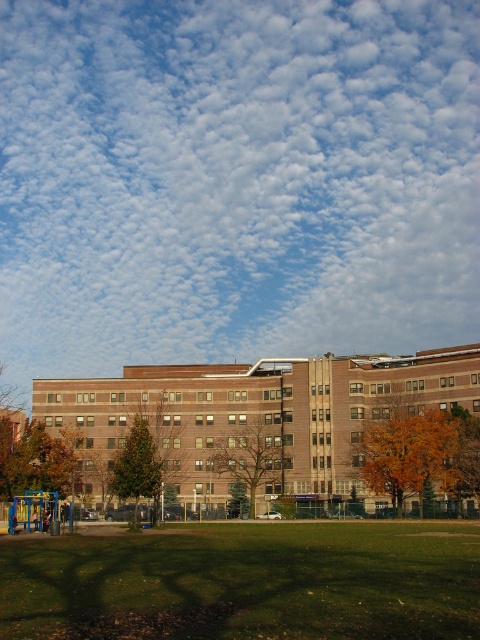
Question: Can you confirm if white fluffy cloud at upper center is positioned to the right of green matte tree at center?

Choices:
 (A) yes
 (B) no

Answer: (A)

Question: Which object is closer to the camera taking this photo?

Choices:
 (A) brown leafy tree at center
 (B) orange leafy tree at center
 (C) white fluffy cloud at upper center
 (D) brown brick building at center

Answer: (B)

Question: Considering the relative positions of white fluffy cloud at upper center and green matte tree at center in the image provided, where is white fluffy cloud at upper center located with respect to green matte tree at center?

Choices:
 (A) right
 (B) left

Answer: (A)

Question: Which object appears farthest from the camera in this image?

Choices:
 (A) white fluffy cloud at upper center
 (B) brown leafy tree at center

Answer: (A)

Question: Is green grass at lower center above brown leafy tree at center?

Choices:
 (A) yes
 (B) no

Answer: (A)

Question: Which of the following is the farthest from the observer?

Choices:
 (A) green matte tree at center
 (B) orange leafy tree at center
 (C) green grass at lower center
 (D) white fluffy cloud at upper center

Answer: (D)